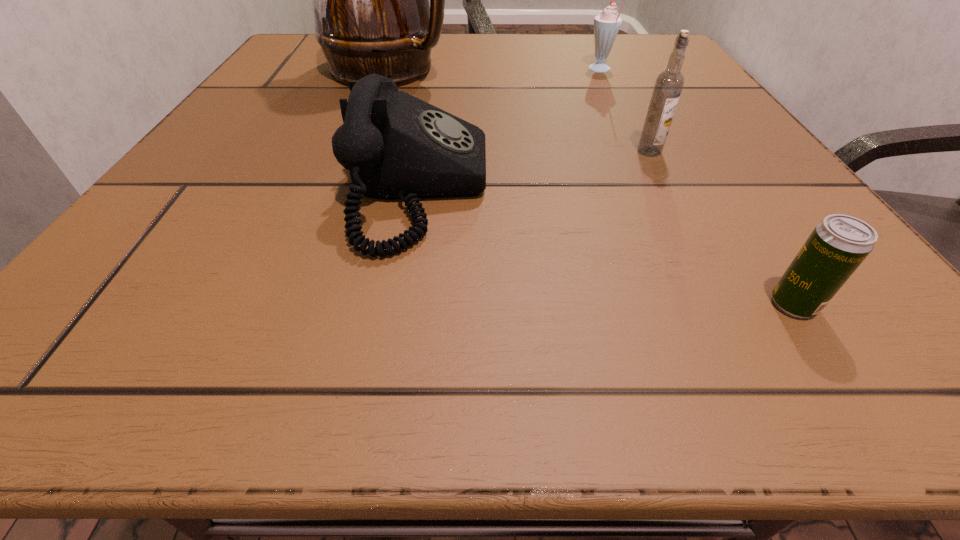
Locate an element on the screen. The width and height of the screenshot is (960, 540). free space between the fourth shortest object and the tallest object is located at coordinates (519, 110).

Find the location of `free area in between the milkshake and the tallest object`. free area in between the milkshake and the tallest object is located at coordinates (495, 70).

This screenshot has height=540, width=960. Find the location of `free space between the milkshake and the telephone`. free space between the milkshake and the telephone is located at coordinates (510, 130).

This screenshot has height=540, width=960. In order to click on vacant space in between the fourth shortest object and the tallest object in this screenshot , I will do `click(519, 110)`.

Locate an element on the screen. vacant space that's between the pitcher and the milkshake is located at coordinates (495, 70).

I want to click on vacant space in between the tallest object and the vodka, so click(x=519, y=110).

I want to click on blank region between the vodka and the tallest object, so click(519, 110).

Where is `free area in between the shortest object and the milkshake`? This screenshot has height=540, width=960. free area in between the shortest object and the milkshake is located at coordinates (697, 187).

The image size is (960, 540). I want to click on blank region between the telephone and the vodka, so click(534, 171).

This screenshot has width=960, height=540. I want to click on object that ranks as the closest to the fourth shortest object, so click(x=396, y=147).